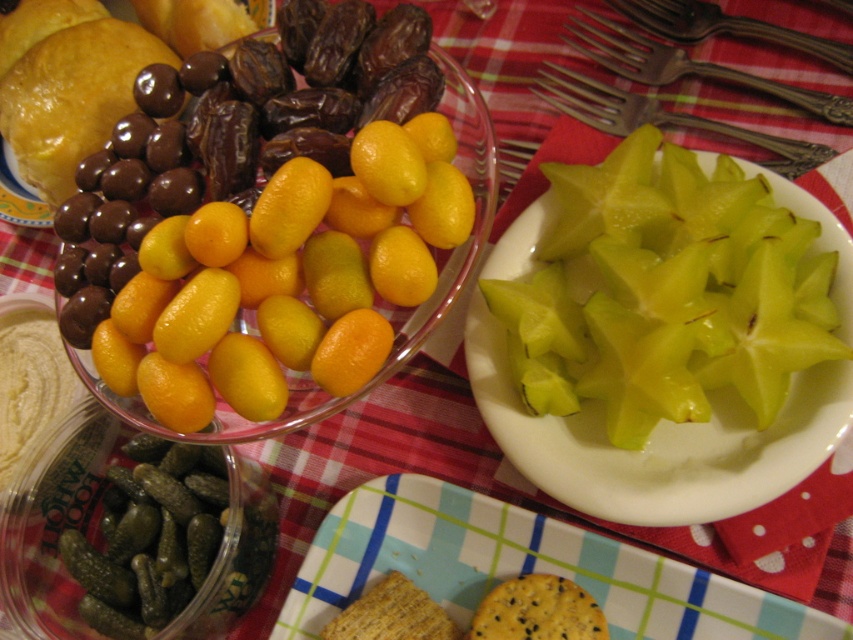
You are a guest at a dinner party and want to eat the yellow matte kumquats at center. You see the polished metal forks at upper right. Which one is bigger in size?

The yellow matte kumquats at center has a larger size compared to the polished metal forks at upper right.

You are a food critic examining the table. You need to determine which of the two items, the seeded cracker at lower center or the polished metal fork at upper right, is shorter. Which one is it?

The seeded cracker at lower center has a lesser height compared to the polished metal fork at upper right, so the seeded cracker at lower center is shorter.